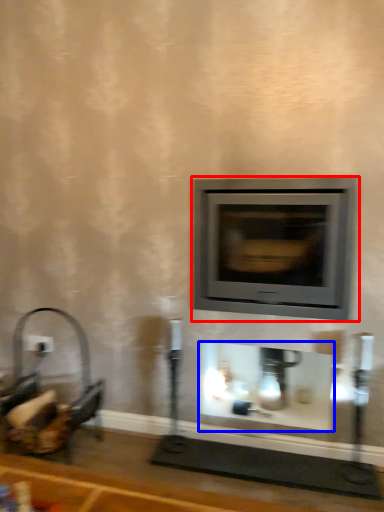
Question: Which object is closer to the camera taking this photo, wood burning stove (highlighted by a red box) or fireplace (highlighted by a blue box)?

Choices:
 (A) wood burning stove
 (B) fireplace

Answer: (A)